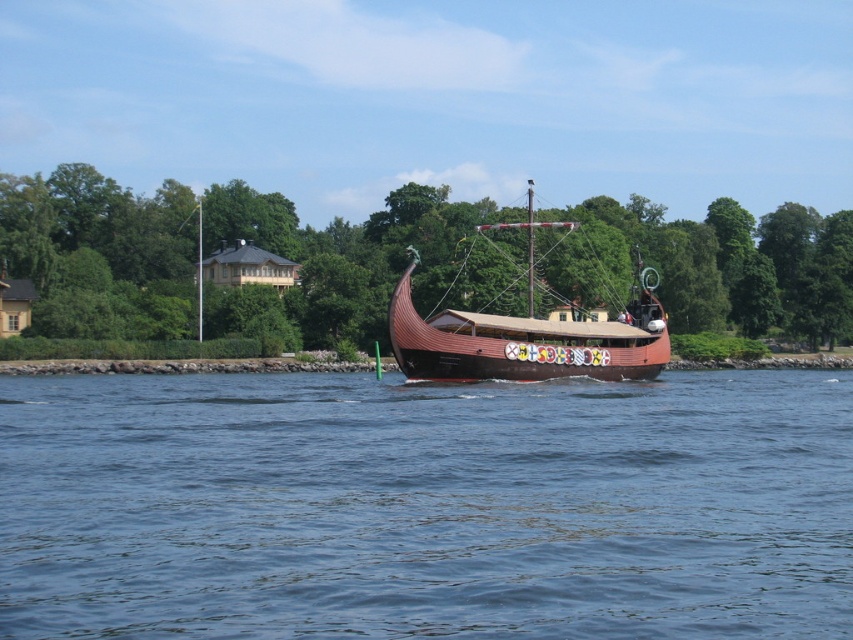
Question: Which of the following is the closest to the observer?

Choices:
 (A) brown wooden pirate ship at center
 (B) blue water at center

Answer: (B)

Question: Is blue water at center above brown wooden pirate ship at center?

Choices:
 (A) no
 (B) yes

Answer: (A)

Question: Can you confirm if blue water at center is positioned above brown wooden pirate ship at center?

Choices:
 (A) no
 (B) yes

Answer: (A)

Question: Does blue water at center have a lesser width compared to brown wooden pirate ship at center?

Choices:
 (A) no
 (B) yes

Answer: (A)